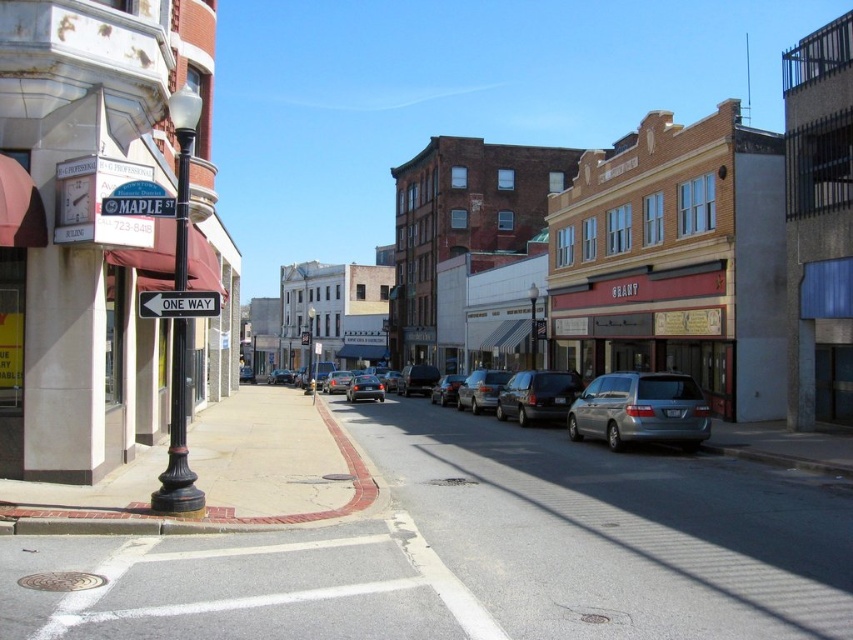
How much distance is there between silver metallic minivan at center and shiny silver sedan at center?

8.24 meters

Can you confirm if silver metallic minivan at center is thinner than shiny silver sedan at center?

No, silver metallic minivan at center is not thinner than shiny silver sedan at center.

Based on the photo, who is more forward, (688, 440) or (444, 396)?

Point (688, 440) is in front.

Locate an element on the screen. This screenshot has height=640, width=853. silver metallic minivan at center is located at coordinates (602, 404).

Can you confirm if maroon awning at left is positioned to the left of silver metallic sedan at center?

Indeed, maroon awning at left is positioned on the left side of silver metallic sedan at center.

Who is more forward, (187, 387) or (494, 388)?

Point (187, 387)

This screenshot has width=853, height=640. What are the coordinates of `maroon awning at left` in the screenshot? It's located at (91, 225).

Does black matte van at center come behind shiny silver sedan at center?

No, black matte van at center is closer to the viewer.

Between black matte van at center and shiny silver sedan at center, which one has less height?

Standing shorter between the two is shiny silver sedan at center.

I want to click on black matte van at center, so click(x=537, y=396).

In order to click on black matte van at center in this screenshot , I will do `click(537, 396)`.